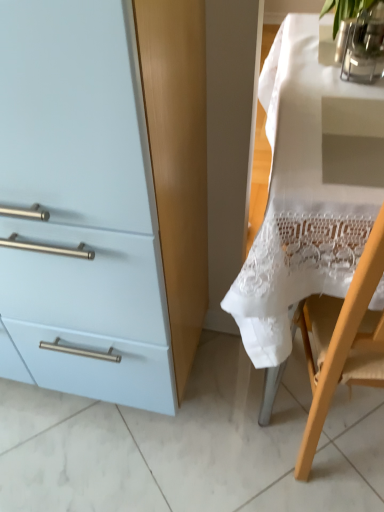
What do you see at coordinates (342, 38) in the screenshot? I see `clear glass vase at upper right, the 2th glass vase from the front` at bounding box center [342, 38].

What do you see at coordinates (103, 196) in the screenshot? I see `light blue matte cabinet at left` at bounding box center [103, 196].

Locate an element on the screen. white lace tablecloth at right is located at coordinates (307, 195).

How much space does clear glass vase at upper right, which is counted as the 1th glass vase, starting from the front, occupy vertically?

10.96 centimeters.

At what (x,y) coordinates should I click in order to perform the action: click on clear glass vase at upper right, marked as the first glass vase in a back-to-front arrangement. Please return your answer as a coordinate pair (x, y). Looking at the image, I should click on (342, 38).

Is clear glass vase at upper right, the second glass vase positioned from the back, inside or outside of clear glass vase at upper right, marked as the first glass vase in a back-to-front arrangement?

clear glass vase at upper right, the second glass vase positioned from the back, cannot be found inside clear glass vase at upper right, marked as the first glass vase in a back-to-front arrangement.

In the scene shown: Is clear glass vase at upper right, which is counted as the 1th glass vase, starting from the front, next to clear glass vase at upper right, marked as the first glass vase in a back-to-front arrangement, and touching it?

Yes, clear glass vase at upper right, which is counted as the 1th glass vase, starting from the front, is beside clear glass vase at upper right, marked as the first glass vase in a back-to-front arrangement.

Between clear glass vase at upper right, the second glass vase positioned from the back, and clear glass vase at upper right, the 2th glass vase from the front, which one has smaller width?

clear glass vase at upper right, the 2th glass vase from the front.

From the image's perspective, which one is positioned higher, white lace tablecloth at right or clear glass vase at upper right, the second glass vase positioned from the back?

clear glass vase at upper right, the second glass vase positioned from the back.

Is white lace tablecloth at right further to camera compared to clear glass vase at upper right, which is counted as the 1th glass vase, starting from the front?

No.

Looking at this image, can we say white lace tablecloth at right lies outside clear glass vase at upper right, which is counted as the 1th glass vase, starting from the front?

Yes, white lace tablecloth at right is outside of clear glass vase at upper right, which is counted as the 1th glass vase, starting from the front.

Considering the relative sizes of white lace tablecloth at right and clear glass vase at upper right, which is counted as the 1th glass vase, starting from the front, in the image provided, is white lace tablecloth at right thinner than clear glass vase at upper right, which is counted as the 1th glass vase, starting from the front,?

No.

From the image's perspective, is clear glass vase at upper right, the second glass vase positioned from the back, below white lace tablecloth at right?

No, from the image's perspective, clear glass vase at upper right, the second glass vase positioned from the back, is not beneath white lace tablecloth at right.

Considering the points (367, 58) and (348, 162), which point is behind, point (367, 58) or point (348, 162)?

The point (367, 58) is more distant.

Between clear glass vase at upper right, the second glass vase positioned from the back, and white lace tablecloth at right, which one has larger size?

white lace tablecloth at right is bigger.

Is clear glass vase at upper right, the second glass vase positioned from the back, facing away from white lace tablecloth at right?

clear glass vase at upper right, the second glass vase positioned from the back, is not turned away from white lace tablecloth at right.

From a real-world perspective, between clear glass vase at upper right, the 2th glass vase from the front, and light blue matte cabinet at left, who is vertically lower?

light blue matte cabinet at left is physically lower.

From the image's perspective, would you say clear glass vase at upper right, marked as the first glass vase in a back-to-front arrangement, is positioned over light blue matte cabinet at left?

Yes, from the image's perspective, clear glass vase at upper right, marked as the first glass vase in a back-to-front arrangement, is on top of light blue matte cabinet at left.

Identify the location of cabinetry that appears below the clear glass vase at upper right, marked as the first glass vase in a back-to-front arrangement (from the image's perspective). tap(103, 196).

From a real-world perspective, which object stands above the other?

From a 3D spatial view, clear glass vase at upper right, which is counted as the 1th glass vase, starting from the front, is above.

Is clear glass vase at upper right, the 2th glass vase from the front, spatially inside clear glass vase at upper right, which is counted as the 1th glass vase, starting from the front, or outside of it?

clear glass vase at upper right, the 2th glass vase from the front, is spatially situated outside clear glass vase at upper right, which is counted as the 1th glass vase, starting from the front.

Can you confirm if clear glass vase at upper right, the 2th glass vase from the front, is smaller than clear glass vase at upper right, the second glass vase positioned from the back?

Yes.

Is clear glass vase at upper right, the 2th glass vase from the front, far away from clear glass vase at upper right, the second glass vase positioned from the back?

clear glass vase at upper right, the 2th glass vase from the front, is near clear glass vase at upper right, the second glass vase positioned from the back, not far away.

Is there a large distance between light blue matte cabinet at left and white lace tablecloth at right?

No, light blue matte cabinet at left is in close proximity to white lace tablecloth at right.

Between light blue matte cabinet at left and white lace tablecloth at right, which one has smaller width?

light blue matte cabinet at left.

In the image, is light blue matte cabinet at left positioned in front of or behind white lace tablecloth at right?

light blue matte cabinet at left is positioned closer to the viewer than white lace tablecloth at right.

From the image's perspective, who appears lower, light blue matte cabinet at left or white lace tablecloth at right?

From the image's view, light blue matte cabinet at left is below.

From the image's perspective, between light blue matte cabinet at left and clear glass vase at upper right, the 2th glass vase from the front, who is located below?

light blue matte cabinet at left, from the image's perspective.

Is light blue matte cabinet at left smaller than clear glass vase at upper right, the 2th glass vase from the front?

Actually, light blue matte cabinet at left might be larger than clear glass vase at upper right, the 2th glass vase from the front.

In the scene shown: Is light blue matte cabinet at left not close to clear glass vase at upper right, the 2th glass vase from the front?

They are positioned close to each other.

Looking at this image, considering the sizes of objects light blue matte cabinet at left and clear glass vase at upper right, marked as the first glass vase in a back-to-front arrangement, in the image provided, who is thinner, light blue matte cabinet at left or clear glass vase at upper right, marked as the first glass vase in a back-to-front arrangement,?

Thinner between the two is clear glass vase at upper right, marked as the first glass vase in a back-to-front arrangement.

Image resolution: width=384 pixels, height=512 pixels. I want to click on glass vase lying in front of the clear glass vase at upper right, the 2th glass vase from the front, so click(365, 46).

The image size is (384, 512). In order to click on the 1st glass vase above the white lace tablecloth at right (from the image's perspective) in this screenshot , I will do `click(365, 46)`.

When comparing their distances from white lace tablecloth at right, does clear glass vase at upper right, the 2th glass vase from the front, or clear glass vase at upper right, which is counted as the 1th glass vase, starting from the front, seem further?

Among the two, clear glass vase at upper right, the 2th glass vase from the front, is located further to white lace tablecloth at right.

Considering their positions, is white lace tablecloth at right positioned further to light blue matte cabinet at left than clear glass vase at upper right, the second glass vase positioned from the back?

clear glass vase at upper right, the second glass vase positioned from the back.

Estimate the real-world distances between objects in this image. Which object is further from clear glass vase at upper right, which is counted as the 1th glass vase, starting from the front, white lace tablecloth at right or light blue matte cabinet at left?

light blue matte cabinet at left.

Estimate the real-world distances between objects in this image. Which object is closer to light blue matte cabinet at left, clear glass vase at upper right, which is counted as the 1th glass vase, starting from the front, or clear glass vase at upper right, marked as the first glass vase in a back-to-front arrangement?

clear glass vase at upper right, which is counted as the 1th glass vase, starting from the front.

Which object lies further to the anchor point clear glass vase at upper right, the second glass vase positioned from the back, light blue matte cabinet at left or white lace tablecloth at right?

The object further to clear glass vase at upper right, the second glass vase positioned from the back, is light blue matte cabinet at left.

From the image, which object appears to be farther from white lace tablecloth at right, clear glass vase at upper right, the 2th glass vase from the front, or light blue matte cabinet at left?

clear glass vase at upper right, the 2th glass vase from the front.

Estimate the real-world distances between objects in this image. Which object is closer to clear glass vase at upper right, marked as the first glass vase in a back-to-front arrangement, light blue matte cabinet at left or white lace tablecloth at right?

The object closer to clear glass vase at upper right, marked as the first glass vase in a back-to-front arrangement, is white lace tablecloth at right.

Which object lies nearer to the anchor point light blue matte cabinet at left, clear glass vase at upper right, marked as the first glass vase in a back-to-front arrangement, or clear glass vase at upper right, the second glass vase positioned from the back?

clear glass vase at upper right, the second glass vase positioned from the back, is positioned closer to the anchor light blue matte cabinet at left.

At what (x,y) coordinates should I click in order to perform the action: click on glass vase between white lace tablecloth at right and clear glass vase at upper right, marked as the first glass vase in a back-to-front arrangement, from front to back. Please return your answer as a coordinate pair (x, y). Image resolution: width=384 pixels, height=512 pixels. Looking at the image, I should click on (365, 46).

Find the location of a particular element. The height and width of the screenshot is (512, 384). glass vase between light blue matte cabinet at left and clear glass vase at upper right, the second glass vase positioned from the back is located at coordinates (342, 38).